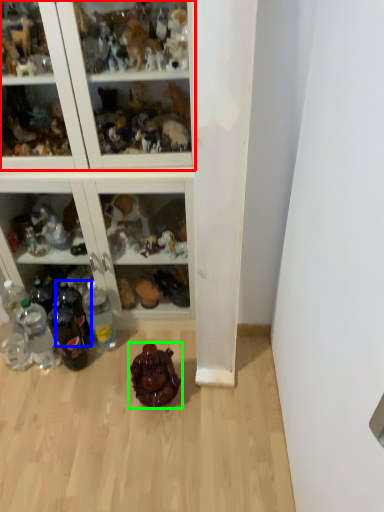
Question: Based on their relative distances, which object is farther from shelf (highlighted by a red box)? Choose from bottle (highlighted by a blue box) and toy (highlighted by a green box).

Choices:
 (A) bottle
 (B) toy

Answer: (B)